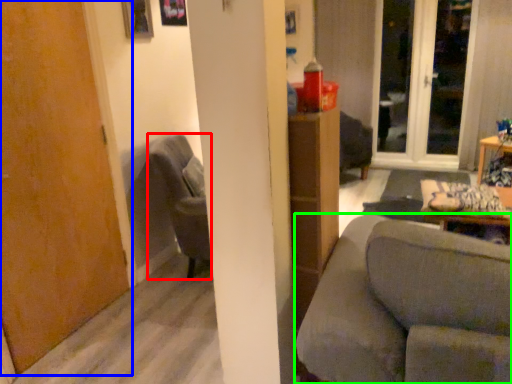
Question: Considering the real-world distances, which object is closest to chair (highlighted by a red box)? door (highlighted by a blue box) or studio couch (highlighted by a green box).

Choices:
 (A) door
 (B) studio couch

Answer: (A)